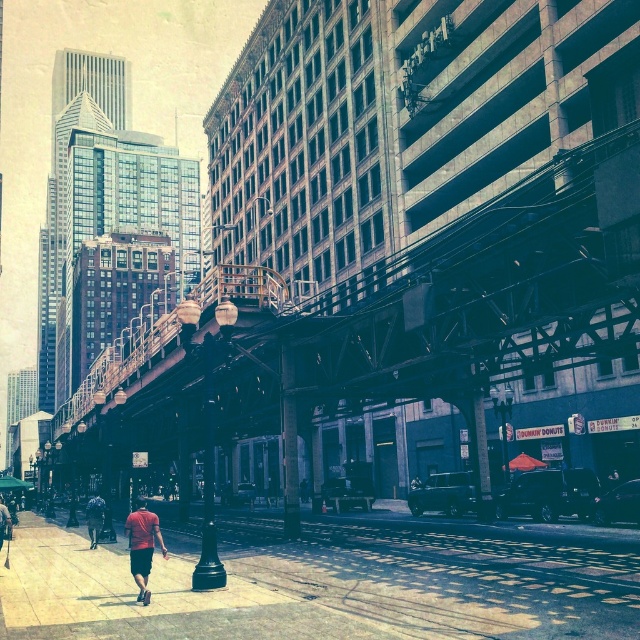
You are a pedestrian standing on the sidewalk in the scene. You see the black glossy streetlight at center and the dark blue jeans at center. Which object is located to the right of the other?

The black glossy streetlight at center is positioned on the right side of dark blue jeans at center, so the streetlight is to the right of the jeans.

You are standing at the point closer to the camera in the image. Which point are you at, point (x=486, y=563) or point (x=96, y=538)?

You are at point (x=486, y=563) because it is closer to the camera than point (x=96, y=538).

From the picture: You are standing on the sidewalk and want to reach the point at coordinates point (128, 536). Given that the average walking speed is 1.4 m per second, how many seconds will it take to reach that point?

The point at coordinates point (128, 536) is 35.64 meters away from the viewer. At an average walking speed of 1.4 meters per second, it would take approximately 25.46 seconds to reach that point.